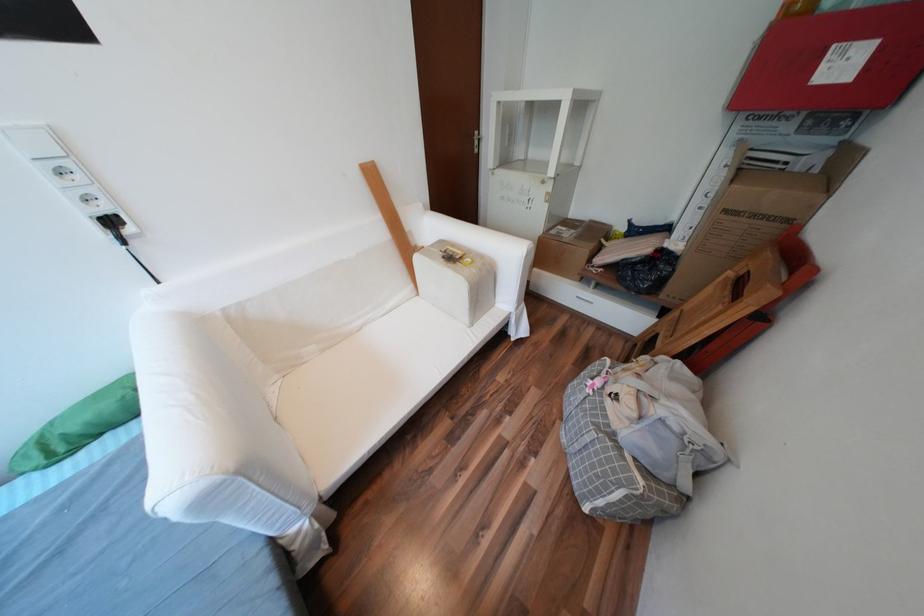
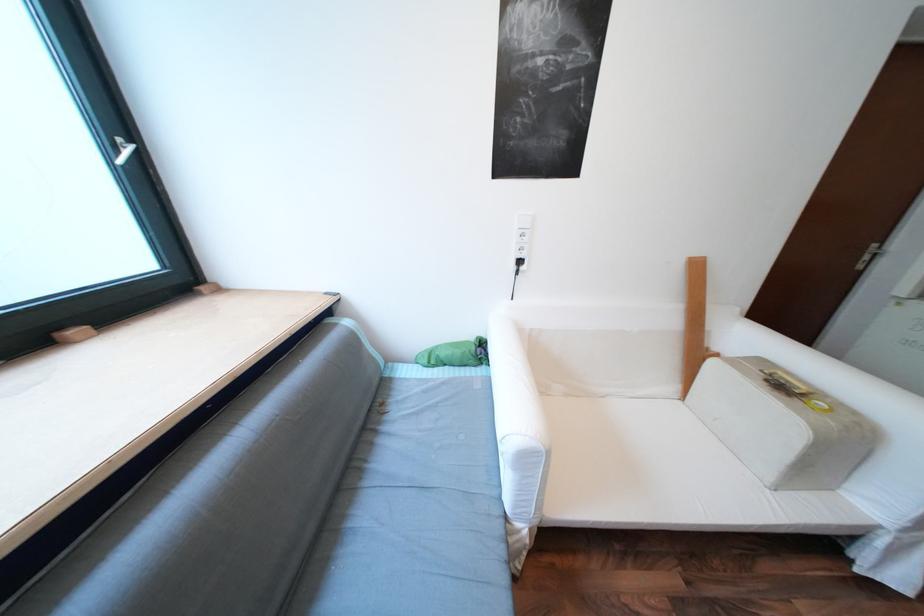
Find the pixel in the second image that matches the point at 287,524 in the first image.

(528, 511)